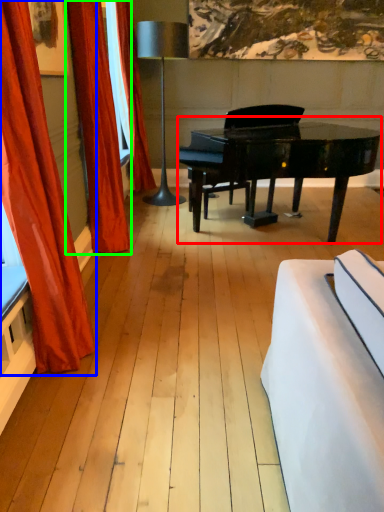
Question: Which object is positioned closest to piano (highlighted by a red box)? Select from curtain (highlighted by a blue box) and curtain (highlighted by a green box).

Choices:
 (A) curtain
 (B) curtain

Answer: (B)